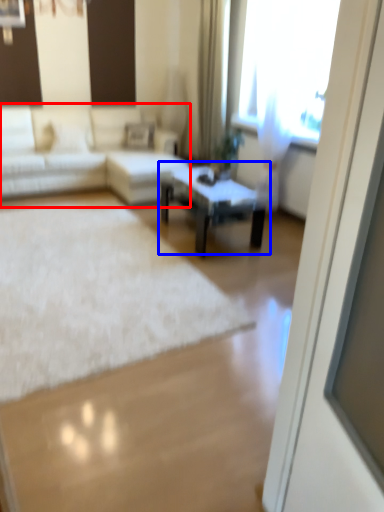
Question: Which of the following is the farthest to the observer, studio couch (highlighted by a red box) or coffee table (highlighted by a blue box)?

Choices:
 (A) studio couch
 (B) coffee table

Answer: (A)